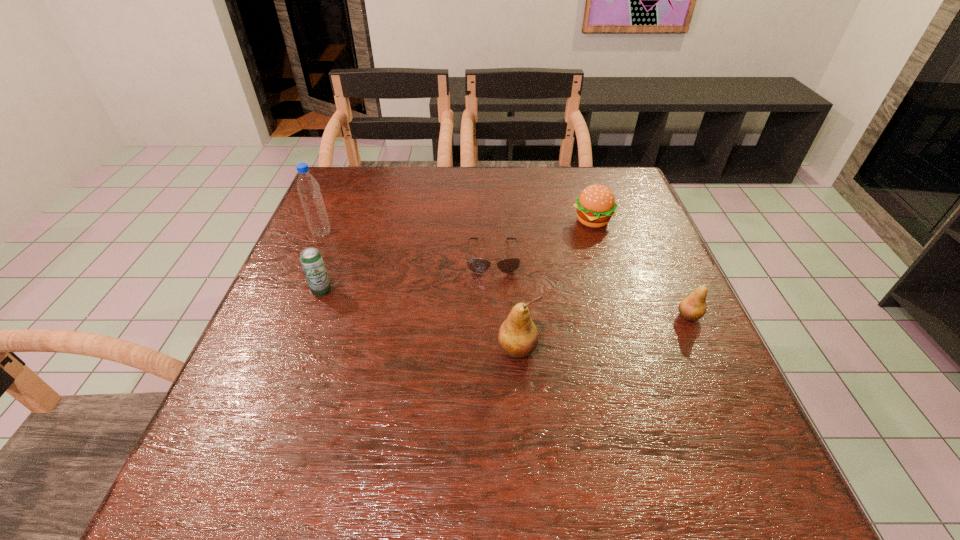
The image size is (960, 540). I want to click on free spot between the nearest object and the sunglasses, so click(x=505, y=303).

Where is `vacant space that is in between the taller pear and the rightmost object`? This screenshot has width=960, height=540. vacant space that is in between the taller pear and the rightmost object is located at coordinates 603,333.

You are a GUI agent. You are given a task and a screenshot of the screen. Output one action in this format:
    pyautogui.click(x=<x>, y=<y>)
    Task: Click on the empty location between the shorter pear and the fifth object from right to left
    The height and width of the screenshot is (540, 960).
    Given the screenshot: What is the action you would take?
    pyautogui.click(x=505, y=303)

Image resolution: width=960 pixels, height=540 pixels. What are the coordinates of `vacant space that's between the sunglasses and the rightmost object` in the screenshot? It's located at (590, 286).

The image size is (960, 540). Identify the location of empty space that is in between the right pear and the taller pear. (603, 333).

Where is `free spot between the second object from left to right and the rightmost object`? The width and height of the screenshot is (960, 540). free spot between the second object from left to right and the rightmost object is located at coordinates (505, 303).

This screenshot has width=960, height=540. Identify the location of object that stands as the third closest to the second object from left to right. (518, 337).

Where is `the third closest object relative to the sunglasses`? The width and height of the screenshot is (960, 540). the third closest object relative to the sunglasses is located at coordinates (311, 259).

Find the location of `vacant space that satisfies the following two spatial constraints: 1. on the front-facing side of the shortest object; 2. on the right side of the fifth shortest object`. vacant space that satisfies the following two spatial constraints: 1. on the front-facing side of the shortest object; 2. on the right side of the fifth shortest object is located at coordinates (496, 349).